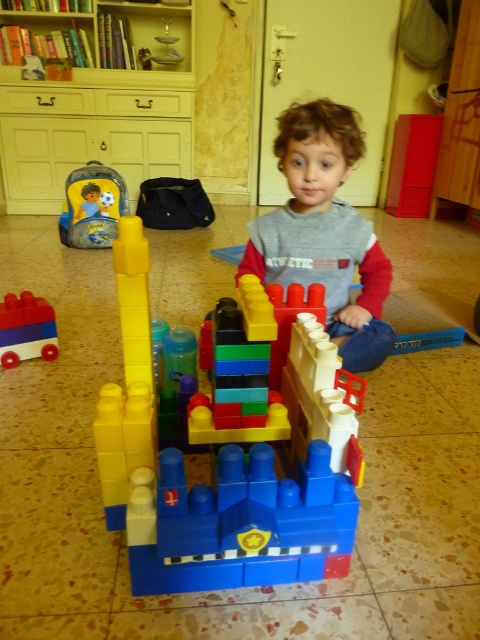
What object is located at the coordinates point (223, 467) in the image?

The brick like plastic castle at center is located at point (223, 467).